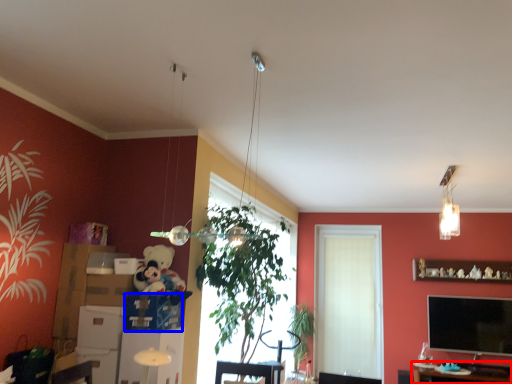
Question: Which point is closer to the camera, table (highlighted by a red box) or cardboard box (highlighted by a blue box)?

Choices:
 (A) table
 (B) cardboard box

Answer: (B)